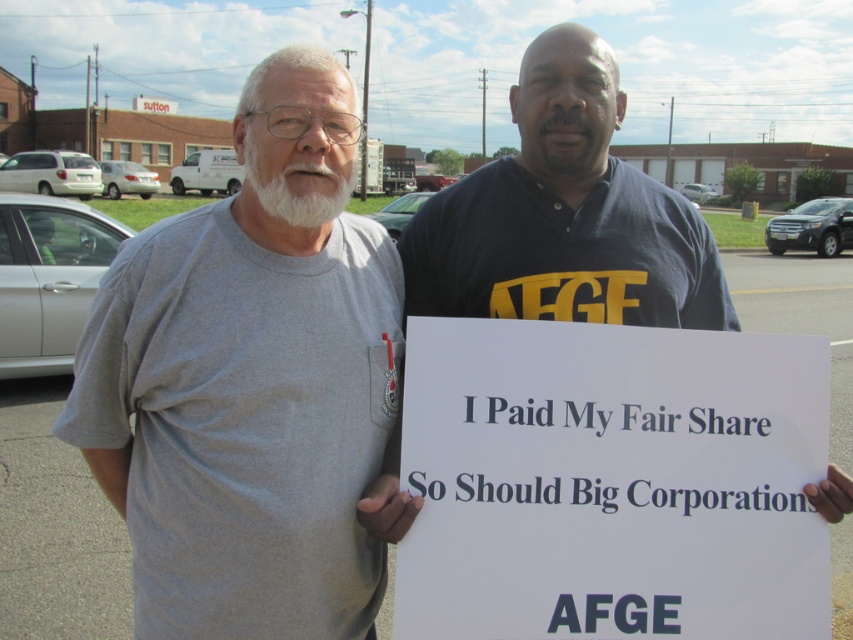
Question: Among these objects, which one is nearest to the camera?

Choices:
 (A) gray cotton t-shirt at center
 (B) white paper sign at center

Answer: (B)

Question: Is gray cotton t-shirt at center below white paper sign at center?

Choices:
 (A) yes
 (B) no

Answer: (B)

Question: Is gray cotton t-shirt at center bigger than white paper sign at center?

Choices:
 (A) yes
 (B) no

Answer: (A)

Question: Which point appears farthest from the camera in this image?

Choices:
 (A) (274, 556)
 (B) (554, 428)

Answer: (B)

Question: Does gray cotton t-shirt at center have a lesser width compared to white paper sign at center?

Choices:
 (A) no
 (B) yes

Answer: (B)